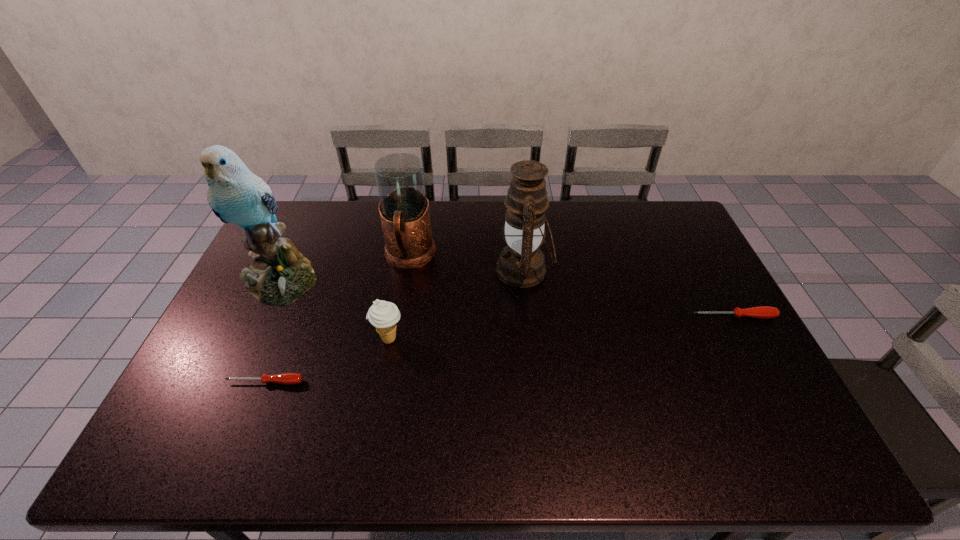
I want to click on the nearer screwdriver, so click(285, 378).

Identify the location of the shorter screwdriver. Image resolution: width=960 pixels, height=540 pixels. (285, 378).

What are the coordinates of `the rightmost object` in the screenshot? It's located at (762, 312).

The width and height of the screenshot is (960, 540). In order to click on the taller screwdriver in this screenshot , I will do `click(762, 312)`.

Locate an element on the screen. Image resolution: width=960 pixels, height=540 pixels. the fifth object from left to right is located at coordinates (521, 264).

Identify the location of the fourth shortest object. The image size is (960, 540). (404, 211).

I want to click on parakeet, so click(x=279, y=275).

Find the location of a particular element. The width and height of the screenshot is (960, 540). icecream is located at coordinates (383, 315).

Locate an element on the screen. This screenshot has height=540, width=960. the second nearest object is located at coordinates tap(383, 315).

The height and width of the screenshot is (540, 960). In order to click on vacant area located 0.150m on the right of the nearest object in this screenshot , I will do pyautogui.click(x=361, y=382).